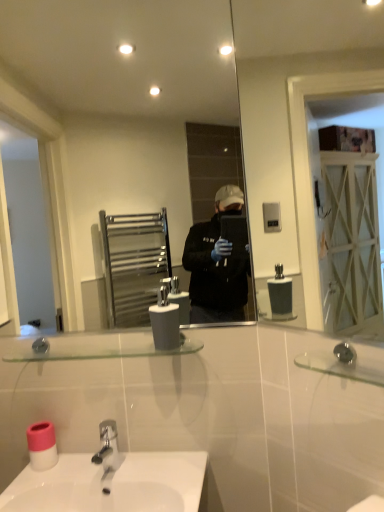
Question: In the image, is clear glass mirror at upper right, positioned as the 2th mirror in back-to-front order, positioned in front of or behind white matte soap dispenser at center?

Choices:
 (A) front
 (B) behind

Answer: (A)

Question: Is clear glass mirror at upper right, the 2th mirror in the left-to-right sequence, inside or outside of white matte soap dispenser at center?

Choices:
 (A) outside
 (B) inside

Answer: (A)

Question: Which object is the farthest from the pink plastic toilet paper at lower left?

Choices:
 (A) clear glass shelf at center
 (B) white matte soap dispenser at center
 (C) clear glass mirror at center, the 1th mirror positioned from the left
 (D) clear glass mirror at upper right, placed as the 1th mirror when sorted from right to left

Answer: (C)

Question: Estimate the real-world distances between objects in this image. Which object is closer to the clear glass mirror at center, acting as the 2th mirror starting from the right?

Choices:
 (A) clear glass shelf at center
 (B) clear glass mirror at upper right, which is counted as the 1th mirror, starting from the front
 (C) white matte soap dispenser at center
 (D) pink plastic toilet paper at lower left

Answer: (B)